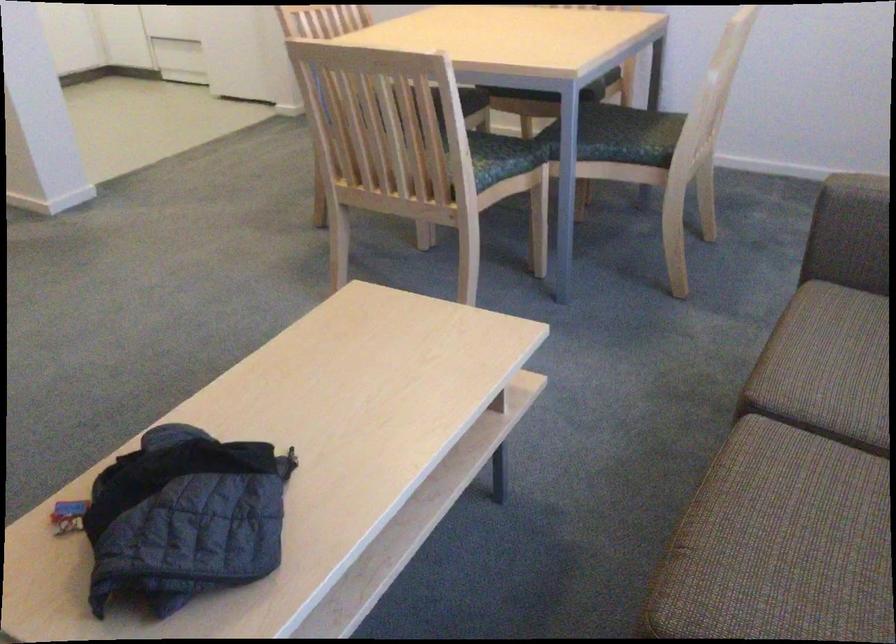
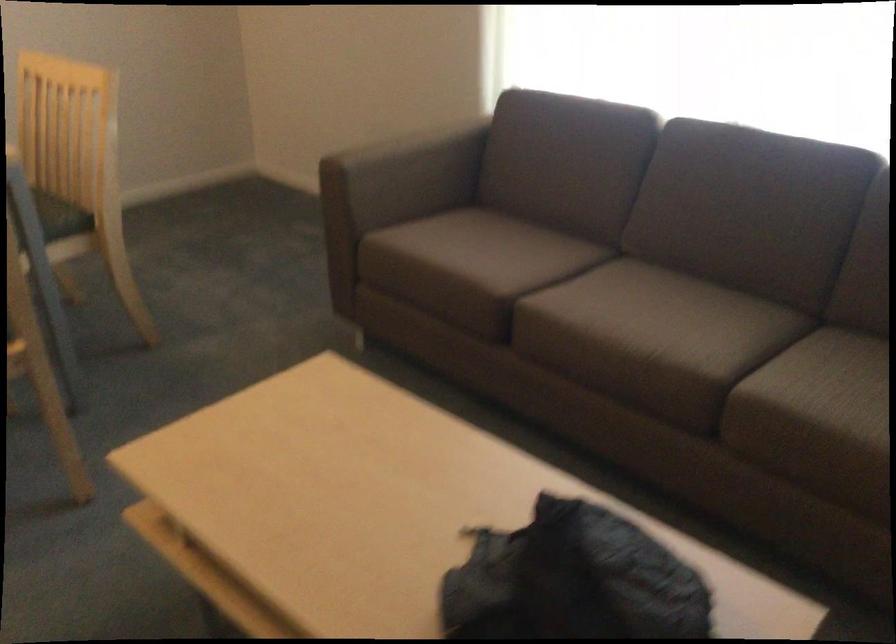
Locate, in the second image, the point that corresponds to [645,146] in the first image.

(61, 216)